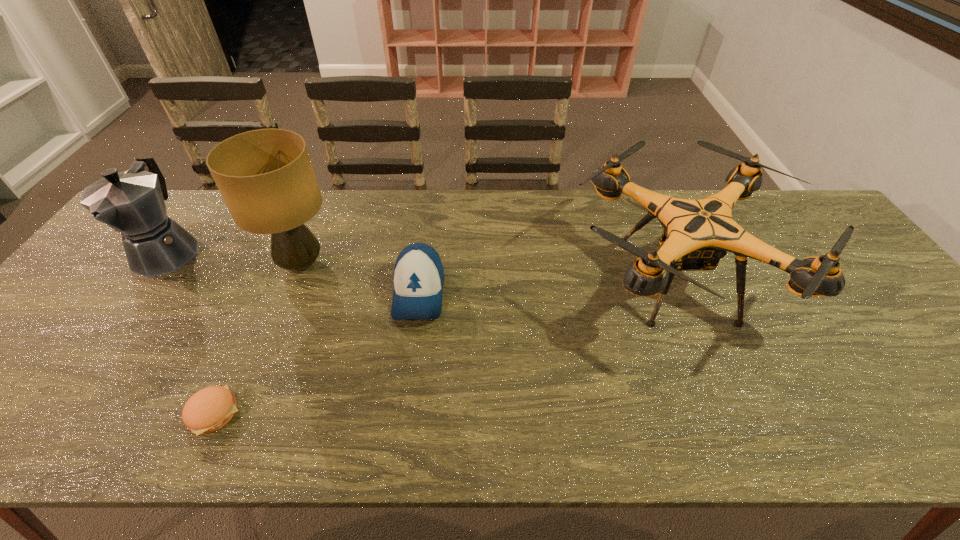
Where is `the tallest object`? the tallest object is located at coordinates [x=266, y=178].

Identify the location of coffeepot. Image resolution: width=960 pixels, height=540 pixels. (132, 203).

Identify the location of the rightmost object. The height and width of the screenshot is (540, 960). (697, 233).

This screenshot has height=540, width=960. Identify the location of baseball cap. (418, 277).

Find the location of a particular element. This screenshot has width=960, height=540. the fourth object from left to right is located at coordinates (418, 277).

Image resolution: width=960 pixels, height=540 pixels. Find the location of `the nearest object`. the nearest object is located at coordinates (208, 410).

Where is `patty`? The height and width of the screenshot is (540, 960). patty is located at coordinates (208, 410).

Image resolution: width=960 pixels, height=540 pixels. Identify the location of free location located on the front of the tallest object. click(249, 395).

You are a GUI agent. You are given a task and a screenshot of the screen. Output one action in this format:
    pyautogui.click(x=<x>, y=<y>)
    Task: Click on the blank area located 0.300m at the spout of the leftmost object
    The image size is (960, 540).
    Given the screenshot: What is the action you would take?
    pyautogui.click(x=73, y=382)

Locate an element on the screen. The width and height of the screenshot is (960, 540). vacant position located 0.270m on the camera mount of the rightmost object is located at coordinates (469, 280).